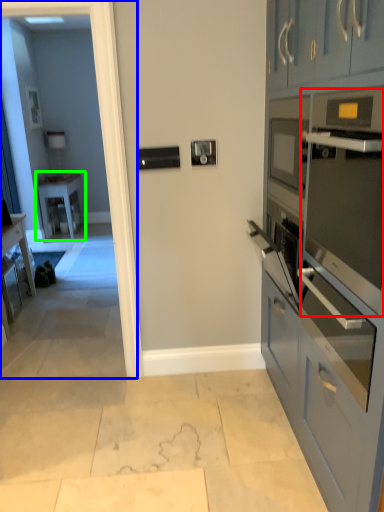
Question: Which object is the farthest from oven (highlighted by a red box)? Choose among these: glass door (highlighted by a blue box) or table (highlighted by a green box).

Choices:
 (A) glass door
 (B) table

Answer: (B)